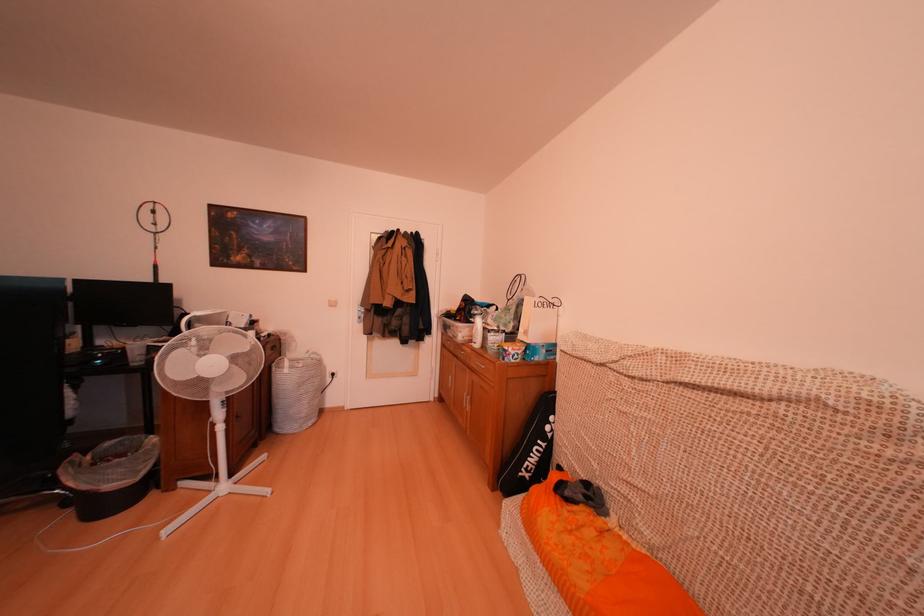
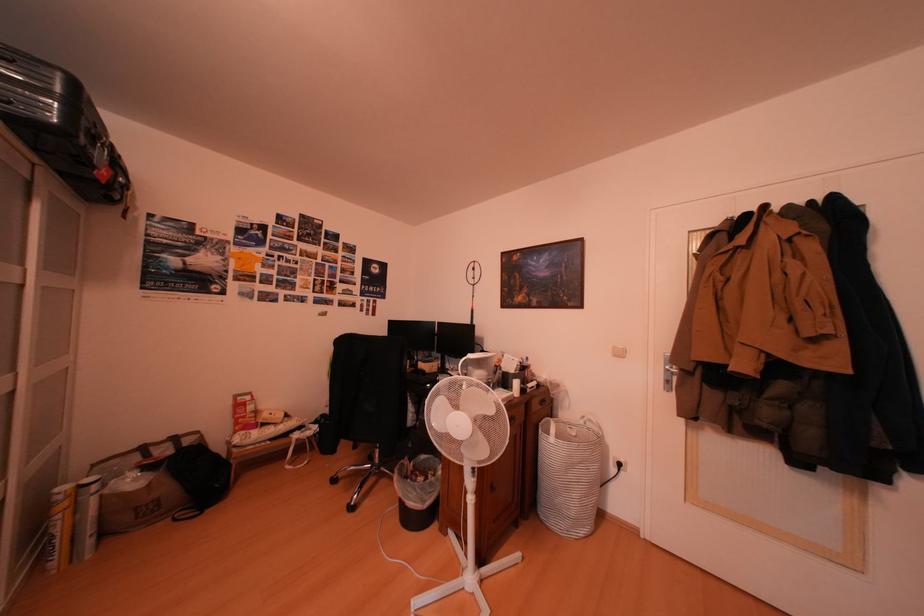
The point at [222,422] is marked in the first image. Where is the corresponding point in the second image?

(476, 485)